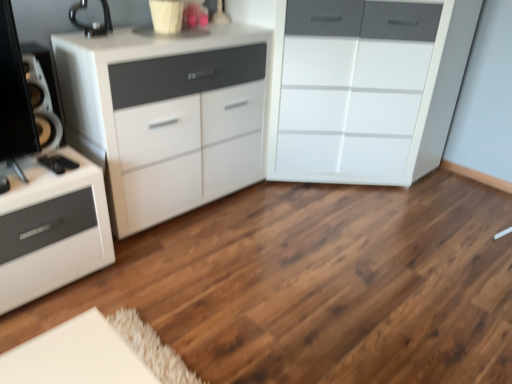
Image resolution: width=512 pixels, height=384 pixels. Identify the location of white glossy cabinet at upper left, which is the first chest of drawers in left-to-right order. [168, 116].

What is the approximate width of white glossy cabinet at upper left, which is the first chest of drawers in left-to-right order?

It is 17.78 inches.

Measure the distance between point (167, 218) and camera.

Point (167, 218) and camera are 7.36 feet apart from each other.

Describe the element at coordinates (168, 116) in the screenshot. I see `white glossy cabinet at upper left, the 2th chest of drawers from the right` at that location.

Image resolution: width=512 pixels, height=384 pixels. In order to click on white glossy chest of drawers at center, placed as the 2th chest of drawers when sorted from left to right in this screenshot , I will do `click(368, 88)`.

The height and width of the screenshot is (384, 512). What do you see at coordinates (368, 88) in the screenshot?
I see `white glossy chest of drawers at center, placed as the first chest of drawers when sorted from right to left` at bounding box center [368, 88].

Find the location of a particular element. white glossy cabinet at upper left, which is the first chest of drawers in left-to-right order is located at coordinates (168, 116).

Would you say white glossy cabinet at upper left, the 2th chest of drawers from the right, is to the left or to the right of white glossy chest of drawers at center, placed as the first chest of drawers when sorted from right to left, in the picture?

white glossy cabinet at upper left, the 2th chest of drawers from the right, is positioned on white glossy chest of drawers at center, placed as the first chest of drawers when sorted from right to left,'s left side.

Is white glossy cabinet at upper left, the 2th chest of drawers from the right, in front of or behind white glossy chest of drawers at center, placed as the first chest of drawers when sorted from right to left, in the image?

white glossy cabinet at upper left, the 2th chest of drawers from the right, is positioned closer to the viewer than white glossy chest of drawers at center, placed as the first chest of drawers when sorted from right to left.

Which is behind, point (134, 210) or point (451, 37)?

The point (451, 37) is farther.

From the image's perspective, between white glossy cabinet at upper left, which is the first chest of drawers in left-to-right order, and white glossy chest of drawers at center, placed as the first chest of drawers when sorted from right to left, who is located below?

From the image's view, white glossy cabinet at upper left, which is the first chest of drawers in left-to-right order, is below.

From a real-world perspective, is white glossy cabinet at upper left, which is the first chest of drawers in left-to-right order, below white glossy chest of drawers at center, placed as the 2th chest of drawers when sorted from left to right?

Yes.

Which object is wider, white glossy cabinet at upper left, which is the first chest of drawers in left-to-right order, or white glossy chest of drawers at center, placed as the first chest of drawers when sorted from right to left?

white glossy chest of drawers at center, placed as the first chest of drawers when sorted from right to left.

Who is shorter, white glossy cabinet at upper left, which is the first chest of drawers in left-to-right order, or white glossy chest of drawers at center, placed as the first chest of drawers when sorted from right to left?

With less height is white glossy cabinet at upper left, which is the first chest of drawers in left-to-right order.

Considering the relative sizes of white glossy cabinet at upper left, the 2th chest of drawers from the right, and white glossy chest of drawers at center, placed as the first chest of drawers when sorted from right to left, in the image provided, is white glossy cabinet at upper left, the 2th chest of drawers from the right, smaller than white glossy chest of drawers at center, placed as the first chest of drawers when sorted from right to left,?

Yes.

Would you say white glossy cabinet at upper left, which is the first chest of drawers in left-to-right order, contains white glossy chest of drawers at center, placed as the first chest of drawers when sorted from right to left?

No.

Is white glossy cabinet at upper left, which is the first chest of drawers in left-to-right order, placed right next to white glossy chest of drawers at center, placed as the first chest of drawers when sorted from right to left?

There is a gap between white glossy cabinet at upper left, which is the first chest of drawers in left-to-right order, and white glossy chest of drawers at center, placed as the first chest of drawers when sorted from right to left.

Is white glossy cabinet at upper left, which is the first chest of drawers in left-to-right order, facing towards white glossy chest of drawers at center, placed as the 2th chest of drawers when sorted from left to right?

No, white glossy cabinet at upper left, which is the first chest of drawers in left-to-right order, is not facing towards white glossy chest of drawers at center, placed as the 2th chest of drawers when sorted from left to right.

The height and width of the screenshot is (384, 512). I want to click on the chest of drawers that is under the white glossy chest of drawers at center, placed as the 2th chest of drawers when sorted from left to right (from a real-world perspective), so click(168, 116).

Is white glossy chest of drawers at center, placed as the first chest of drawers when sorted from right to left, to the left of white glossy cabinet at upper left, which is the first chest of drawers in left-to-right order, from the viewer's perspective?

In fact, white glossy chest of drawers at center, placed as the first chest of drawers when sorted from right to left, is to the right of white glossy cabinet at upper left, which is the first chest of drawers in left-to-right order.

Between white glossy chest of drawers at center, placed as the first chest of drawers when sorted from right to left, and white glossy cabinet at upper left, which is the first chest of drawers in left-to-right order, which one is positioned in front?

white glossy cabinet at upper left, which is the first chest of drawers in left-to-right order, is more forward.

Is point (435, 4) positioned after point (67, 136)?

That is True.

From the image's perspective, which is above, white glossy chest of drawers at center, placed as the 2th chest of drawers when sorted from left to right, or white glossy cabinet at upper left, the 2th chest of drawers from the right?

white glossy chest of drawers at center, placed as the 2th chest of drawers when sorted from left to right, from the image's perspective.

From a real-world perspective, relative to white glossy cabinet at upper left, the 2th chest of drawers from the right, is white glossy chest of drawers at center, placed as the first chest of drawers when sorted from right to left, vertically above or below?

From a real-world perspective, white glossy chest of drawers at center, placed as the first chest of drawers when sorted from right to left, is physically above white glossy cabinet at upper left, the 2th chest of drawers from the right.

Considering the sizes of objects white glossy chest of drawers at center, placed as the first chest of drawers when sorted from right to left, and white glossy cabinet at upper left, the 2th chest of drawers from the right, in the image provided, who is thinner, white glossy chest of drawers at center, placed as the first chest of drawers when sorted from right to left, or white glossy cabinet at upper left, the 2th chest of drawers from the right,?

white glossy cabinet at upper left, the 2th chest of drawers from the right, is thinner.

Does white glossy chest of drawers at center, placed as the first chest of drawers when sorted from right to left, have a greater height compared to white glossy cabinet at upper left, which is the first chest of drawers in left-to-right order?

Yes.

Is white glossy chest of drawers at center, placed as the first chest of drawers when sorted from right to left, bigger or smaller than white glossy cabinet at upper left, which is the first chest of drawers in left-to-right order?

white glossy chest of drawers at center, placed as the first chest of drawers when sorted from right to left, is bigger than white glossy cabinet at upper left, which is the first chest of drawers in left-to-right order.

Is white glossy cabinet at upper left, which is the first chest of drawers in left-to-right order, inside white glossy chest of drawers at center, placed as the 2th chest of drawers when sorted from left to right?

No.

Is white glossy chest of drawers at center, placed as the 2th chest of drawers when sorted from left to right, touching white glossy cabinet at upper left, the 2th chest of drawers from the right?

white glossy chest of drawers at center, placed as the 2th chest of drawers when sorted from left to right, and white glossy cabinet at upper left, the 2th chest of drawers from the right, are not in contact.

Could you tell me if white glossy chest of drawers at center, placed as the first chest of drawers when sorted from right to left, is facing white glossy cabinet at upper left, the 2th chest of drawers from the right?

No, white glossy chest of drawers at center, placed as the first chest of drawers when sorted from right to left, is not aimed at white glossy cabinet at upper left, the 2th chest of drawers from the right.

How distant is white glossy chest of drawers at center, placed as the first chest of drawers when sorted from right to left, from white glossy cabinet at upper left, the 2th chest of drawers from the right?

The distance of white glossy chest of drawers at center, placed as the first chest of drawers when sorted from right to left, from white glossy cabinet at upper left, the 2th chest of drawers from the right, is 22.12 inches.

The width and height of the screenshot is (512, 384). What are the coordinates of `chest of drawers below the white glossy chest of drawers at center, placed as the first chest of drawers when sorted from right to left (from the image's perspective)` in the screenshot? It's located at (168, 116).

You are a GUI agent. You are given a task and a screenshot of the screen. Output one action in this format:
    pyautogui.click(x=<x>, y=<y>)
    Task: Click on the chest of drawers that is below the white glossy chest of drawers at center, placed as the 2th chest of drawers when sorted from left to right (from the image's perspective)
    The width and height of the screenshot is (512, 384).
    Given the screenshot: What is the action you would take?
    [168, 116]

I want to click on the chest of drawers behind the white glossy cabinet at upper left, the 2th chest of drawers from the right, so click(x=368, y=88).